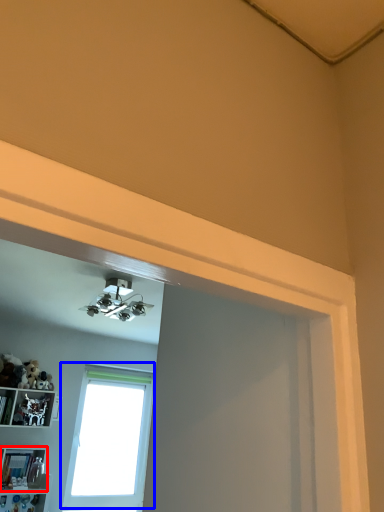
Question: Which object is closer to the camera taking this photo, shelf (highlighted by a red box) or window (highlighted by a blue box)?

Choices:
 (A) shelf
 (B) window

Answer: (A)